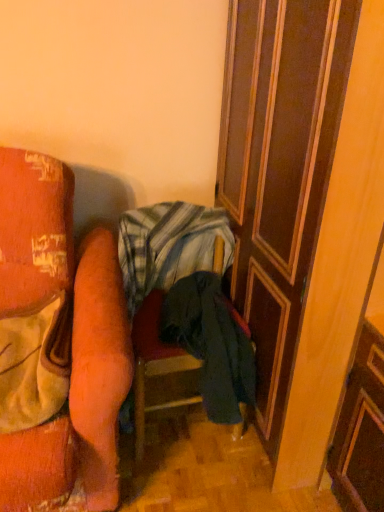
Question: Based on their positions, is wooden at right located to the left or right of dark blue fabric chair at center?

Choices:
 (A) left
 (B) right

Answer: (B)

Question: From a real-world perspective, is wooden at right physically located above or below dark blue fabric chair at center?

Choices:
 (A) below
 (B) above

Answer: (B)

Question: Which object is positioned farthest from the wooden at right?

Choices:
 (A) dark blue fabric chair at center
 (B) striped cotton blanket at center

Answer: (A)

Question: Which of these objects is positioned closest to the dark blue fabric chair at center?

Choices:
 (A) striped cotton blanket at center
 (B) wooden at right

Answer: (A)